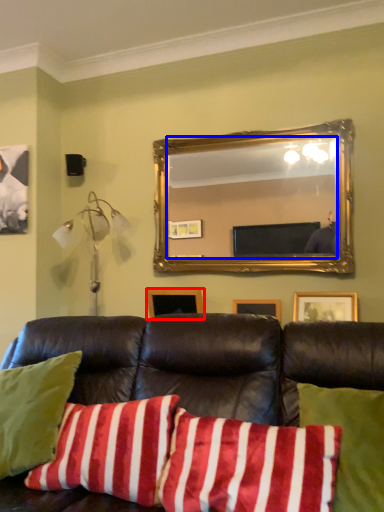
Question: Which point is closer to the camera, picture frame (highlighted by a red box) or mirror (highlighted by a blue box)?

Choices:
 (A) picture frame
 (B) mirror

Answer: (B)